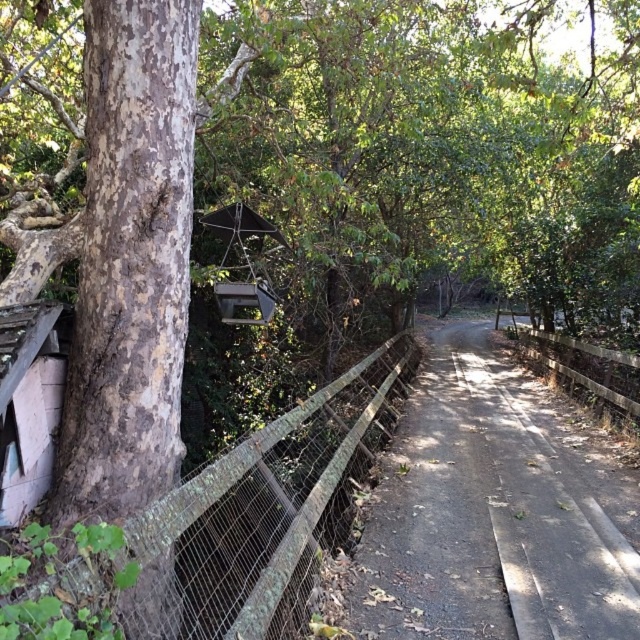
Describe the element at coordinates (29, 401) in the screenshot. This screenshot has height=640, width=640. I see `rustic wooden hut at lower left` at that location.

Is point (10, 305) farther from viewer compared to point (518, 340)?

That is False.

Is point (49, 339) in front of point (588, 346)?

Yes.

Identify the location of rustic wooden hut at lower left. (29, 401).

The width and height of the screenshot is (640, 640). What do you see at coordinates (486, 516) in the screenshot? I see `dirt road at center` at bounding box center [486, 516].

Is dirt road at center further to camera compared to wooden at right?

That is False.

Describe the element at coordinates (486, 516) in the screenshot. The height and width of the screenshot is (640, 640). I see `dirt road at center` at that location.

Where is `dirt road at center`? dirt road at center is located at coordinates (486, 516).

Which of these two, dirt road at center or rustic wooden hut at lower left, stands shorter?

With less height is dirt road at center.

Which is in front, point (488, 588) or point (6, 518)?

Point (6, 518)

The image size is (640, 640). Find the location of `dirt road at center`. dirt road at center is located at coordinates (486, 516).